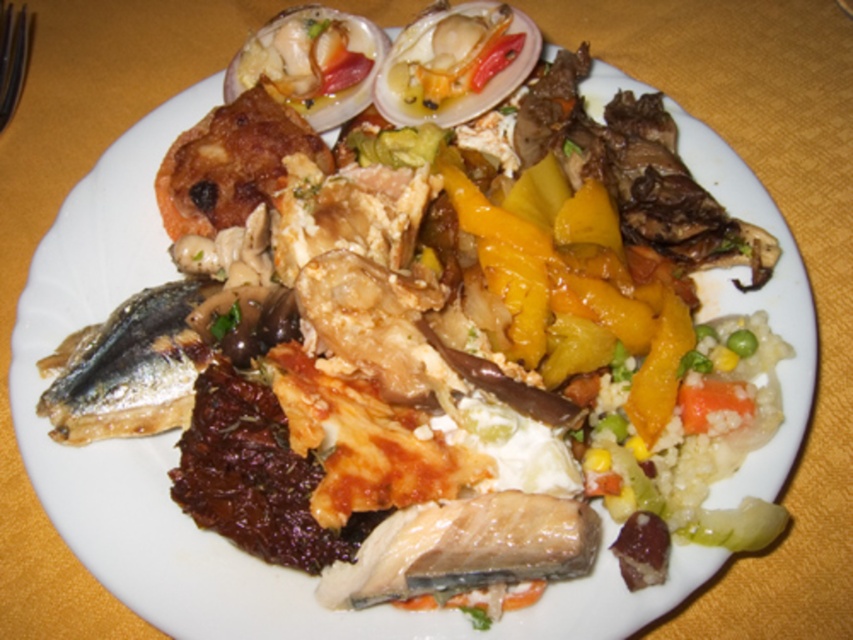
Question: Which point is farther to the camera?

Choices:
 (A) (326, 26)
 (B) (161, 420)

Answer: (A)

Question: Which point is farther to the camera?

Choices:
 (A) shiny silver fish at left
 (B) shiny white shellfish at upper center

Answer: (B)

Question: Can you confirm if shiny silver fish at left is positioned above shiny white shellfish at upper center?

Choices:
 (A) yes
 (B) no

Answer: (B)

Question: Which object appears closest to the camera in this image?

Choices:
 (A) shiny white shellfish at upper center
 (B) shiny silver fish at left

Answer: (B)

Question: From the image, what is the correct spatial relationship of shiny silver fish at left in relation to shiny white shellfish at upper center?

Choices:
 (A) below
 (B) above

Answer: (A)

Question: Is shiny silver fish at left below shiny white shellfish at upper center?

Choices:
 (A) no
 (B) yes

Answer: (B)